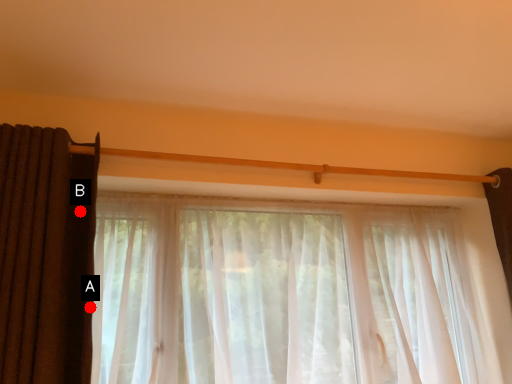
Question: Two points are circled on the image, labeled by A and B beside each circle. Which point is closer to the camera taking this photo?

Choices:
 (A) A is closer
 (B) B is closer

Answer: (A)